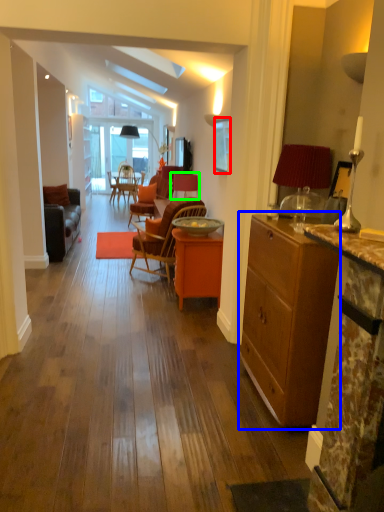
Question: Which object is the closest to the picture frame (highlighted by a red box)? Choose among these: cabinetry (highlighted by a blue box) or chair (highlighted by a green box).

Choices:
 (A) cabinetry
 (B) chair

Answer: (B)